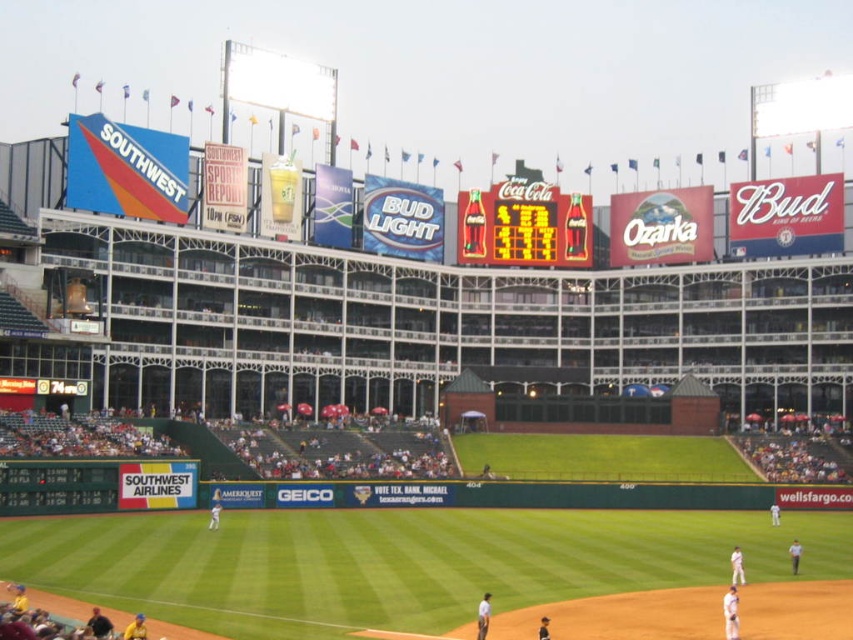
Question: Which point is farther to the camera?

Choices:
 (A) (473, 220)
 (B) (170, 604)

Answer: (A)

Question: Observing the image, what is the correct spatial positioning of green grass at center in reference to shiny plastic coca-cola sign at center?

Choices:
 (A) right
 (B) left

Answer: (B)

Question: Can you confirm if green grass at center is positioned to the left of shiny plastic coca-cola sign at center?

Choices:
 (A) no
 (B) yes

Answer: (B)

Question: Is green grass at center to the left of shiny plastic coca-cola sign at center from the viewer's perspective?

Choices:
 (A) no
 (B) yes

Answer: (B)

Question: Which of the following is the farthest from the observer?

Choices:
 (A) green grass at center
 (B) shiny plastic coca-cola sign at center

Answer: (B)